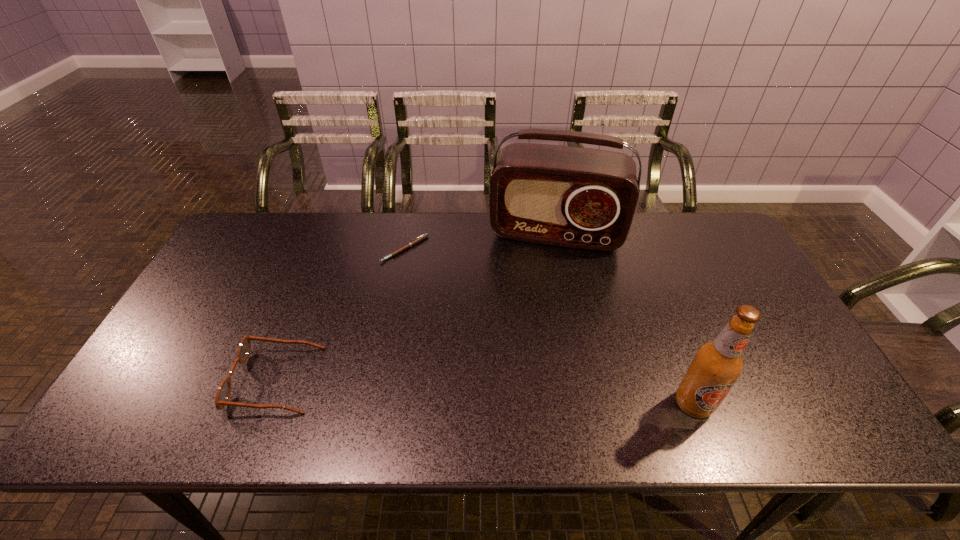
At what (x,y) coordinates should I click in order to perform the action: click on free space on the desktop that is between the spectacles and the beer bottle and is positioned at the nib of the third object from right to left. Please return your answer as a coordinate pair (x, y). Looking at the image, I should click on (420, 388).

Identify the location of vacant space on the desktop that is between the spectacles and the beer bottle and is positioned on the front panel of the radio receiver. The height and width of the screenshot is (540, 960). (535, 395).